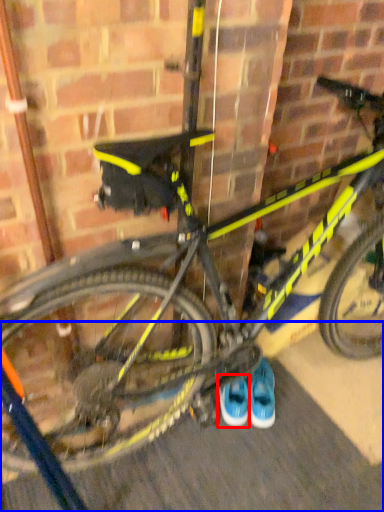
Question: Which of the following is the farthest to the observer, footwear (highlighted by a red box) or pavement (highlighted by a blue box)?

Choices:
 (A) footwear
 (B) pavement

Answer: (A)